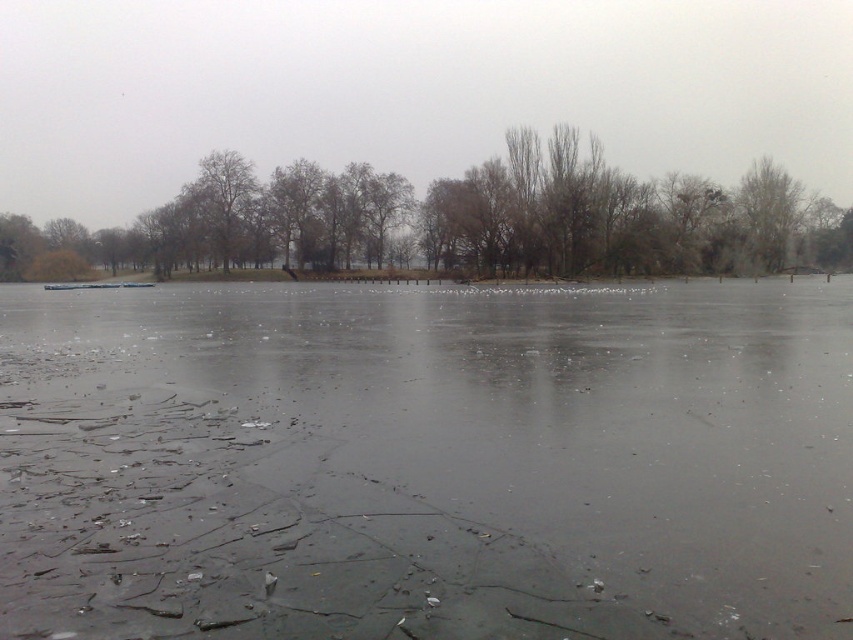
Which is below, transparent ice at center or bare branches at upper right?

Positioned lower is transparent ice at center.

Who is positioned more to the right, transparent ice at center or bare branches at upper right?

bare branches at upper right is more to the right.

Does point (444, 618) come in front of point (778, 208)?

Yes.

I want to click on transparent ice at center, so click(x=426, y=461).

Between transparent ice at center and brown leafless trees at upper center, which one is positioned higher?

Positioned higher is brown leafless trees at upper center.

Which is behind, point (109, 604) or point (541, 173)?

The point (541, 173) is behind.

The width and height of the screenshot is (853, 640). I want to click on transparent ice at center, so click(x=426, y=461).

This screenshot has width=853, height=640. Describe the element at coordinates (463, 220) in the screenshot. I see `brown leafless trees at upper center` at that location.

Between brown leafless trees at upper center and bare branches at upper right, which one is positioned higher?

brown leafless trees at upper center is higher up.

Is point (328, 184) more distant than point (769, 260)?

Yes, it is.

Where is `brown leafless trees at upper center`? Image resolution: width=853 pixels, height=640 pixels. brown leafless trees at upper center is located at coordinates (463, 220).